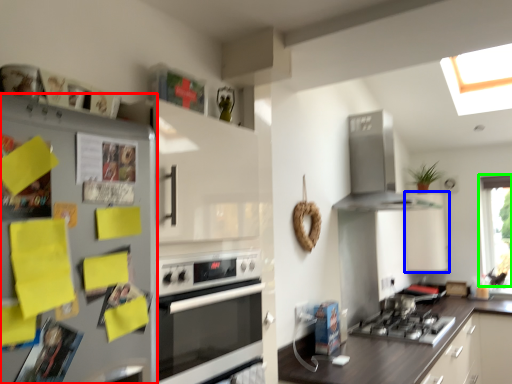
Question: Which object is the farthest from refrigerator (highlighted by a red box)? Choose among these: cabinetry (highlighted by a blue box) or window (highlighted by a green box).

Choices:
 (A) cabinetry
 (B) window

Answer: (B)